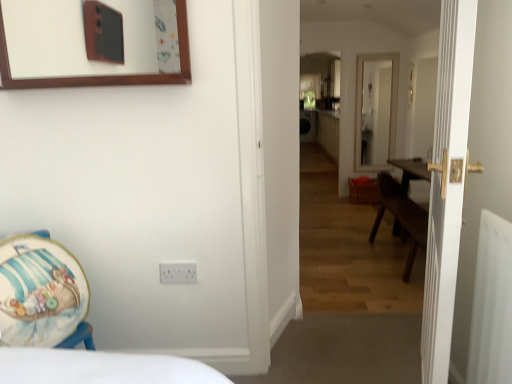
The height and width of the screenshot is (384, 512). Find the location of `vacant space behind wooden floor at center`. vacant space behind wooden floor at center is located at coordinates (340, 340).